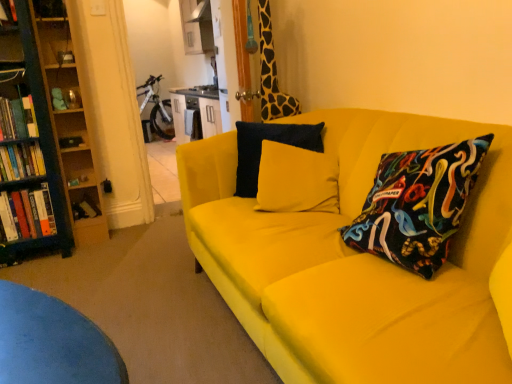
Measure the distance between wooden bookcase at left and camera.

wooden bookcase at left is 7.01 feet from camera.

Measure the distance between hardcover book at left, the second book in the top-to-bottom sequence, and camera.

The depth of hardcover book at left, the second book in the top-to-bottom sequence, is 2.33 meters.

Image resolution: width=512 pixels, height=384 pixels. I want to click on wooden bookshelf at left, so click(69, 115).

How many degrees apart are the facing directions of giraffe-patterned fabric at upper right and wooden bookcase at left?

The facing directions of giraffe-patterned fabric at upper right and wooden bookcase at left are 110 degrees apart.

Measure the distance between giraffe-patterned fabric at upper right and wooden bookcase at left.

→ They are 1.32 meters apart.

Is giraffe-patterned fabric at upper right spatially inside wooden bookcase at left, or outside of it?

giraffe-patterned fabric at upper right is located beyond the bounds of wooden bookcase at left.

From the image's perspective, which one is positioned lower, giraffe-patterned fabric at upper right or wooden bookcase at left?

wooden bookcase at left, from the image's perspective.

From a real-world perspective, relative to wooden bookcase at left, is matte yellow pillow at center vertically above or below?

In terms of real-world spatial position, matte yellow pillow at center is below wooden bookcase at left.

How different are the orientations of matte yellow pillow at center and wooden bookcase at left in degrees?

19.7 degrees separate the facing orientations of matte yellow pillow at center and wooden bookcase at left.

Is matte yellow pillow at center with wooden bookcase at left?

No, matte yellow pillow at center is not touching wooden bookcase at left.

Locate an element on the screen. The width and height of the screenshot is (512, 384). bookcase on the left of matte yellow pillow at center is located at coordinates point(28,144).

Does hardcover book at left, the third book in the bottom-to-top sequence, have a larger size compared to wooden bookshelf at left?

No.

Is hardcover book at left, the third book in the bottom-to-top sequence, outside of wooden bookshelf at left?

That's correct, hardcover book at left, the third book in the bottom-to-top sequence, is outside of wooden bookshelf at left.

Is hardcover book at left, the third book in the bottom-to-top sequence, shorter than wooden bookshelf at left?

Correct, hardcover book at left, the third book in the bottom-to-top sequence, is not as tall as wooden bookshelf at left.

Between hardcover book at left, the second book in the top-to-bottom sequence, and wooden bookshelf at left, which one appears on the right side from the viewer's perspective?

From the viewer's perspective, wooden bookshelf at left appears more on the right side.

Looking at the image, does hardcover book at left, the 1th book in the top-to-bottom sequence, seem bigger or smaller compared to hardcover book at lower left, which is counted as the first book, starting from the bottom?

hardcover book at left, the 1th book in the top-to-bottom sequence, is bigger than hardcover book at lower left, which is counted as the first book, starting from the bottom.

In the image, is hardcover book at left, the 1th book in the top-to-bottom sequence, on the left side or the right side of hardcover book at lower left, the fourth book from the top?

From the image, it's evident that hardcover book at left, the 1th book in the top-to-bottom sequence, is to the left of hardcover book at lower left, the fourth book from the top.

Is hardcover book at left, the 1th book in the top-to-bottom sequence, with hardcover book at lower left, which is counted as the first book, starting from the bottom?

No.

Does hardcover book at left, the 4th book ordered from the bottom, have a greater width compared to hardcover book at lower left, which is counted as the first book, starting from the bottom?

Yes.

From a real-world perspective, is white glossy bicycle at upper center positioned under hardcover book at left, arranged as the 3th book when viewed from the top, based on gravity?

No, from a real-world perspective, white glossy bicycle at upper center is not below hardcover book at left, arranged as the 3th book when viewed from the top.

Is white glossy bicycle at upper center to the right of hardcover book at left, arranged as the 3th book when viewed from the top, from the viewer's perspective?

Incorrect, white glossy bicycle at upper center is not on the right side of hardcover book at left, arranged as the 3th book when viewed from the top.

Considering the sizes of objects white glossy bicycle at upper center and hardcover book at left, which ranks as the 2th book in bottom-to-top order, in the image provided, who is thinner, white glossy bicycle at upper center or hardcover book at left, which ranks as the 2th book in bottom-to-top order,?

With smaller width is hardcover book at left, which ranks as the 2th book in bottom-to-top order.

What's the angular difference between white glossy bicycle at upper center and hardcover book at left, arranged as the 3th book when viewed from the top,'s facing directions?

white glossy bicycle at upper center and hardcover book at left, arranged as the 3th book when viewed from the top, are facing 1.54 degrees away from each other.

Can you tell me how much hardcover book at left, the 1th book in the top-to-bottom sequence, and hardcover book at left, arranged as the 3th book when viewed from the top, differ in facing direction?

The facing directions of hardcover book at left, the 1th book in the top-to-bottom sequence, and hardcover book at left, arranged as the 3th book when viewed from the top, are 0.784 degrees apart.

Which is more to the left, hardcover book at left, the 1th book in the top-to-bottom sequence, or hardcover book at left, which ranks as the 2th book in bottom-to-top order?

From the viewer's perspective, hardcover book at left, which ranks as the 2th book in bottom-to-top order, appears more on the left side.

From a real-world perspective, is hardcover book at left, the 4th book ordered from the bottom, located beneath hardcover book at left, which ranks as the 2th book in bottom-to-top order?

A: Actually, hardcover book at left, the 4th book ordered from the bottom, is physically above hardcover book at left, which ranks as the 2th book in bottom-to-top order, in the real world.

Which object is wider, hardcover book at left, the 4th book ordered from the bottom, or hardcover book at left, which ranks as the 2th book in bottom-to-top order?

hardcover book at left, which ranks as the 2th book in bottom-to-top order, is wider.

Considering the sizes of objects hardcover book at left, the third book in the bottom-to-top sequence, and matte yellow pillow at center in the image provided, who is taller, hardcover book at left, the third book in the bottom-to-top sequence, or matte yellow pillow at center?

With more height is matte yellow pillow at center.

Does hardcover book at left, the third book in the bottom-to-top sequence, appear on the left side of matte yellow pillow at center?

Yes.

Locate an element on the screen. This screenshot has height=384, width=512. the 1st book above the matte yellow pillow at center (from the image's perspective) is located at coordinates (21, 161).

Locate an element on the screen. The height and width of the screenshot is (384, 512). giraffe above the wooden bookcase at left (from a real-world perspective) is located at coordinates (271, 73).

Identify the location of bookcase above the matte yellow pillow at center (from the image's perspective). Image resolution: width=512 pixels, height=384 pixels. (28, 144).

Consider the image. Based on their spatial positions, is yellow fabric couch at center or hardcover book at left, the 4th book ordered from the bottom, closer to hardcover book at left, arranged as the 3th book when viewed from the top?

hardcover book at left, the 4th book ordered from the bottom, lies closer to hardcover book at left, arranged as the 3th book when viewed from the top, than the other object.

When comparing their distances from hardcover book at left, the 1th book in the top-to-bottom sequence, does giraffe-patterned fabric at upper right or wooden bookcase at left seem closer?

The object closer to hardcover book at left, the 1th book in the top-to-bottom sequence, is wooden bookcase at left.

In the scene shown: Estimate the real-world distances between objects in this image. Which object is closer to white glossy bicycle at upper center, hardcover book at left, arranged as the 3th book when viewed from the top, or yellow fabric couch at center?

The object closer to white glossy bicycle at upper center is hardcover book at left, arranged as the 3th book when viewed from the top.

Looking at the image, which one is located closer to hardcover book at lower left, which is counted as the first book, starting from the bottom, matte yellow pillow at center or hardcover book at left, arranged as the 3th book when viewed from the top?

Based on the image, hardcover book at left, arranged as the 3th book when viewed from the top, appears to be nearer to hardcover book at lower left, which is counted as the first book, starting from the bottom.

When comparing their distances from wooden bookshelf at left, does white glossy bicycle at upper center or yellow fabric couch at center seem closer?

yellow fabric couch at center.

When comparing their distances from wooden bookshelf at left, does wooden bookcase at left or yellow fabric couch at center seem closer?

wooden bookcase at left lies closer to wooden bookshelf at left than the other object.

From the image, which object appears to be farther from hardcover book at left, the second book in the top-to-bottom sequence, hardcover book at lower left, the fourth book from the top, or wooden bookshelf at left?

The object further to hardcover book at left, the second book in the top-to-bottom sequence, is hardcover book at lower left, the fourth book from the top.

Estimate the real-world distances between objects in this image. Which object is closer to matte yellow pillow at center, hardcover book at left, which ranks as the 2th book in bottom-to-top order, or wooden bookcase at left?

Among the two, wooden bookcase at left is located nearer to matte yellow pillow at center.

The height and width of the screenshot is (384, 512). I want to click on bookshelf between hardcover book at left, the 1th book in the top-to-bottom sequence, and matte yellow pillow at center, so click(x=69, y=115).

This screenshot has width=512, height=384. I want to click on giraffe positioned between yellow fabric couch at center and hardcover book at lower left, which is counted as the first book, starting from the bottom, from near to far, so click(271, 73).

Image resolution: width=512 pixels, height=384 pixels. Identify the location of giraffe between wooden bookcase at left and matte yellow pillow at center. (271, 73).

Identify the location of giraffe located between hardcover book at lower left, the fourth book from the top, and matte yellow pillow at center in the left-right direction. The height and width of the screenshot is (384, 512). (271, 73).